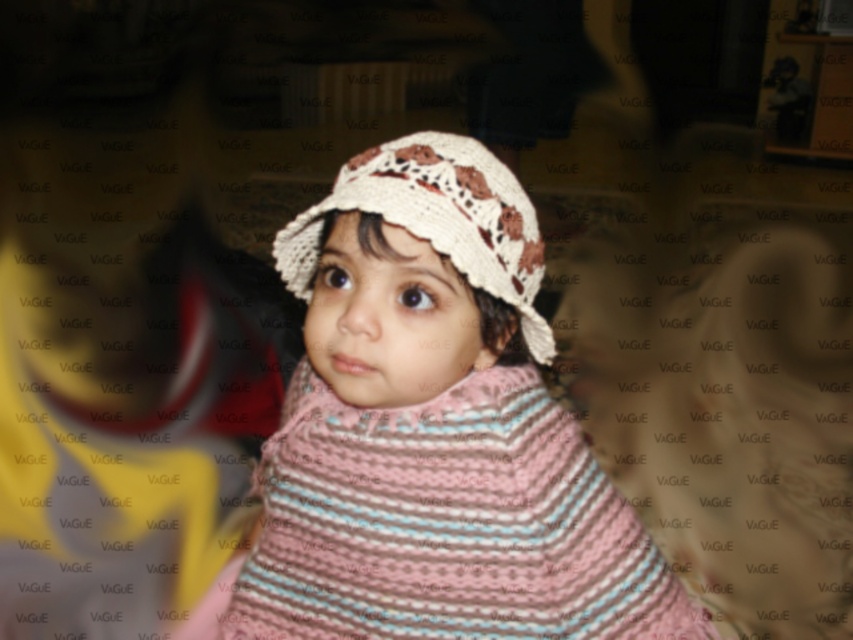
Question: Can you confirm if white knitted hat at center is thinner than crochet beige hat at center?

Choices:
 (A) yes
 (B) no

Answer: (B)

Question: Is white knitted hat at center in front of crochet beige hat at center?

Choices:
 (A) yes
 (B) no

Answer: (A)

Question: Which of the following is the farthest from the observer?

Choices:
 (A) crochet beige hat at center
 (B) white knitted hat at center

Answer: (A)

Question: Which object appears farthest from the camera in this image?

Choices:
 (A) crochet beige hat at center
 (B) white knitted hat at center

Answer: (A)

Question: Can you confirm if white knitted hat at center is bigger than crochet beige hat at center?

Choices:
 (A) yes
 (B) no

Answer: (A)